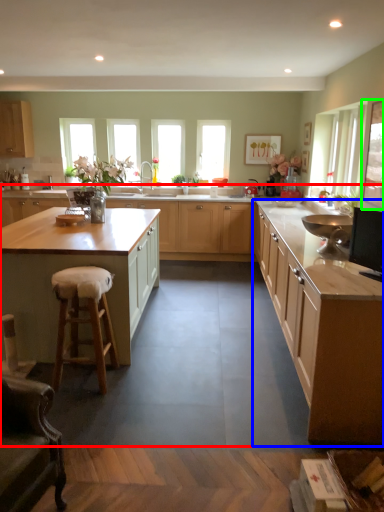
Question: Based on their relative distances, which object is farther from cabinetry (highlighted by a red box)? Choose from cabinetry (highlighted by a blue box) and window screen (highlighted by a green box).

Choices:
 (A) cabinetry
 (B) window screen

Answer: (B)